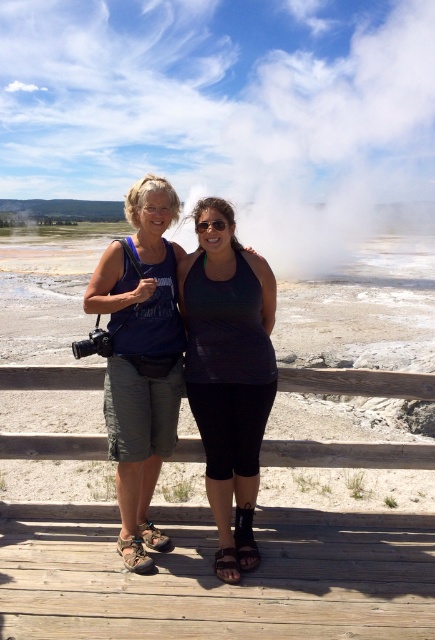
Can you confirm if matte black tank top at center is shorter than matte blue tank top at center?

Yes, matte black tank top at center is shorter than matte blue tank top at center.

Can you confirm if matte black tank top at center is wider than matte blue tank top at center?

Incorrect, matte black tank top at center's width does not surpass matte blue tank top at center's.

Is point (257, 260) behind point (144, 198)?

Yes, it is behind point (144, 198).

Identify the location of matte black tank top at center. The image size is (435, 640). (228, 372).

Which is in front, point (233, 285) or point (200, 220)?

Point (233, 285) is more forward.

Which is more to the right, matte black tank top at center or black matte sunglasses at center?

Positioned to the right is matte black tank top at center.

Image resolution: width=435 pixels, height=640 pixels. In order to click on matte black tank top at center in this screenshot , I will do `click(228, 372)`.

Can you confirm if white vapor at center is wider than matte blue tank top at center?

Correct, the width of white vapor at center exceeds that of matte blue tank top at center.

Between white vapor at center and matte blue tank top at center, which one appears on the left side from the viewer's perspective?

Positioned to the left is matte blue tank top at center.

Which is in front, point (318, 120) or point (143, 221)?

Positioned in front is point (143, 221).

The width and height of the screenshot is (435, 640). Find the location of `white vapor at center`. white vapor at center is located at coordinates (320, 124).